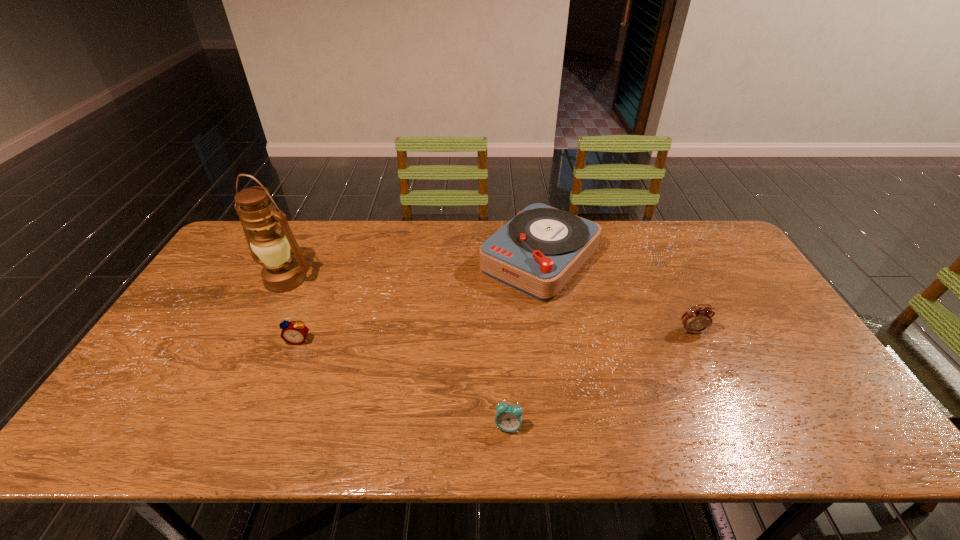
Image resolution: width=960 pixels, height=540 pixels. What are the coordinates of `object that is positioned at the far edge` in the screenshot? It's located at (537, 252).

Where is `object that is at the near edge`? The image size is (960, 540). object that is at the near edge is located at coordinates (508, 418).

Locate an element on the screen. This screenshot has height=540, width=960. object that is at the left edge is located at coordinates (270, 247).

This screenshot has height=540, width=960. Find the location of `blank space at the far edge`. blank space at the far edge is located at coordinates (471, 242).

Image resolution: width=960 pixels, height=540 pixels. Identify the location of free region at the near edge. (651, 436).

The height and width of the screenshot is (540, 960). In order to click on vacant space at the left edge of the desktop in this screenshot , I will do `click(127, 409)`.

At what (x,y) coordinates should I click in order to perform the action: click on vacant area at the right edge of the desktop. Please return your answer as a coordinate pair (x, y). This screenshot has width=960, height=540. Looking at the image, I should click on (710, 284).

The height and width of the screenshot is (540, 960). Find the location of `vacant space at the far right corner`. vacant space at the far right corner is located at coordinates click(x=706, y=221).

The image size is (960, 540). What are the coordinates of `vacant point located between the nearest object and the rightmost object` in the screenshot? It's located at (600, 379).

Find the location of a particular element. Image resolution: width=960 pixels, height=540 pixels. vacant area that lies between the oil lamp and the nearest alarm clock is located at coordinates (396, 353).